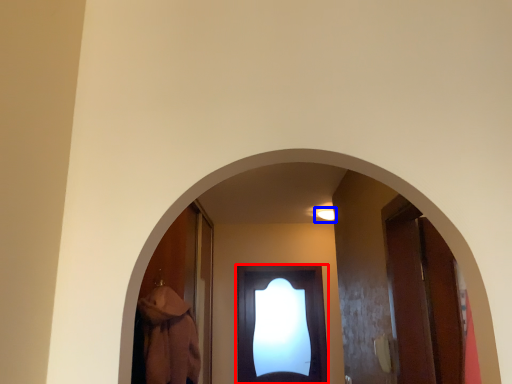
Question: Which point is further to the camera, door (highlighted by a red box) or light (highlighted by a blue box)?

Choices:
 (A) door
 (B) light

Answer: (A)